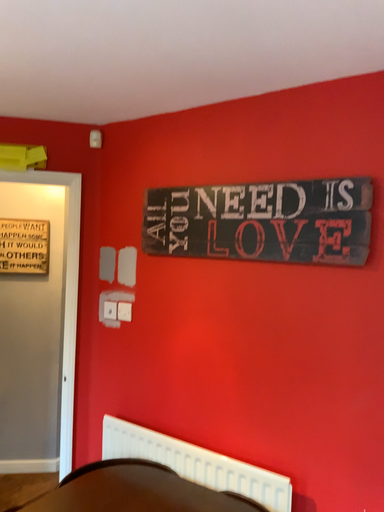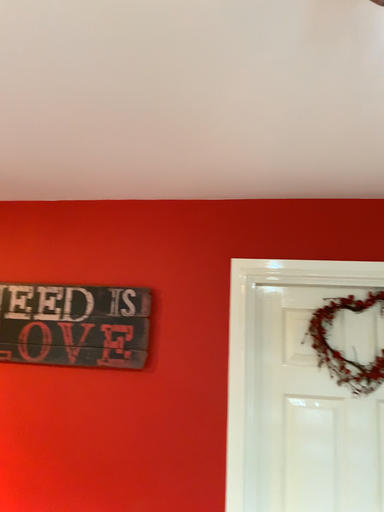
Question: Which way did the camera rotate in the video?

Choices:
 (A) rotated upward
 (B) rotated downward

Answer: (A)